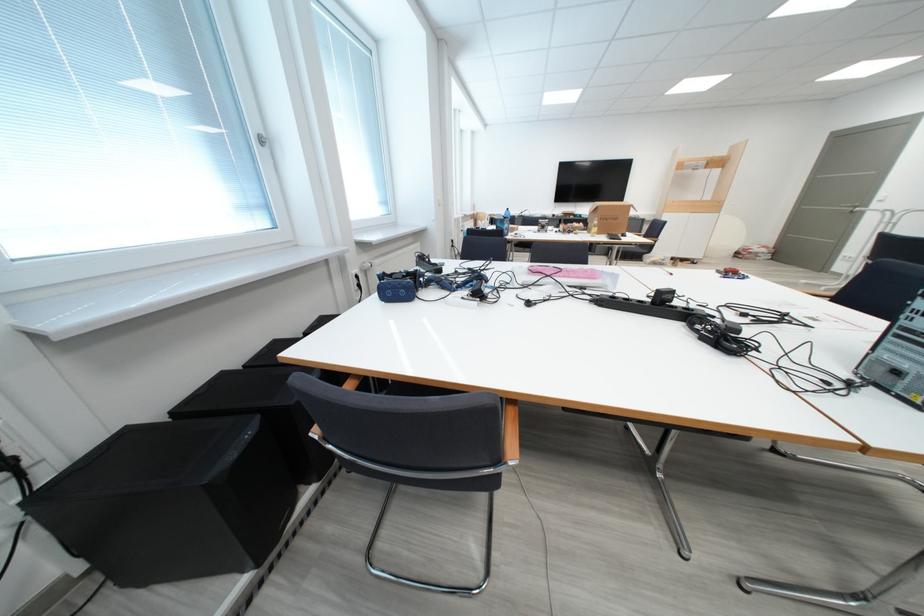
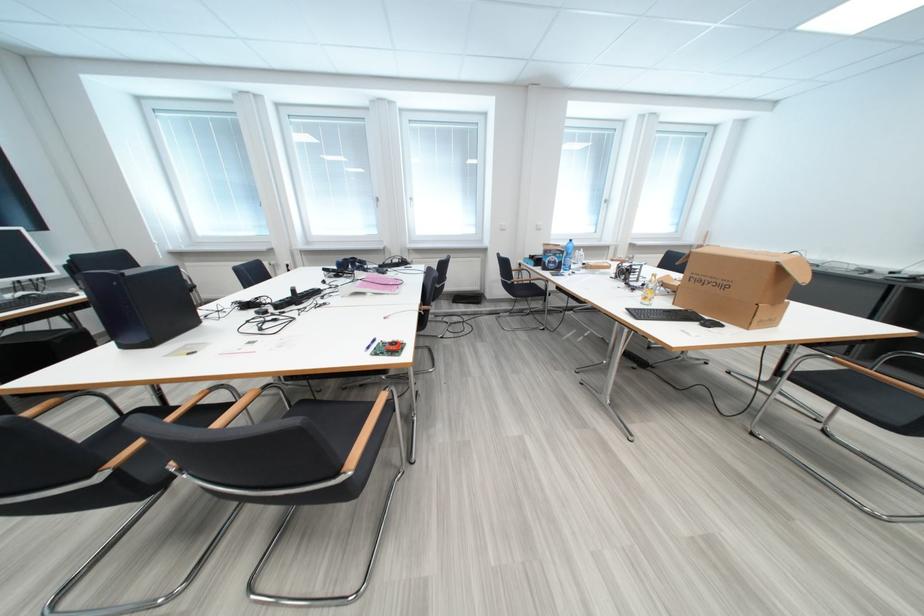
The point at (482, 214) is marked in the first image. Where is the corresponding point in the second image?

(711, 245)